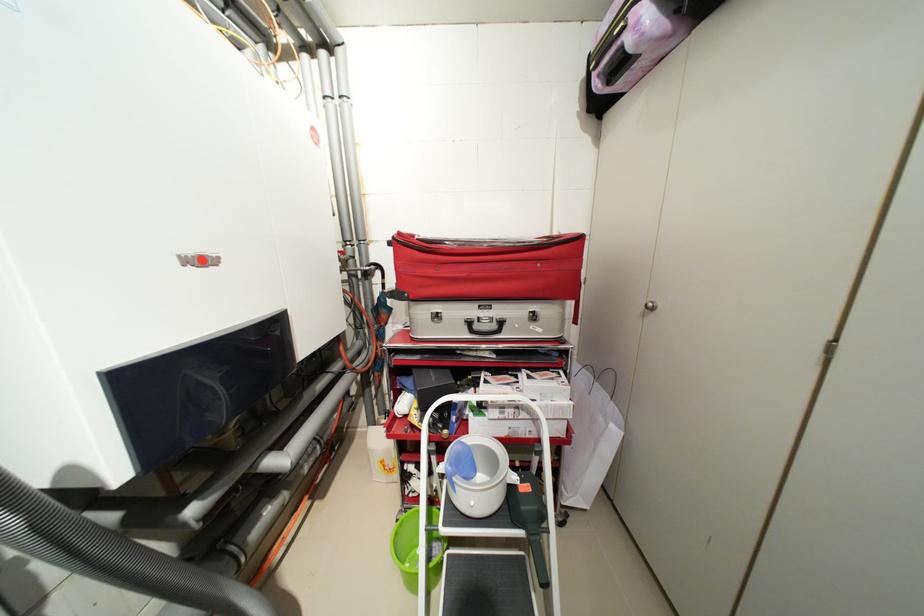
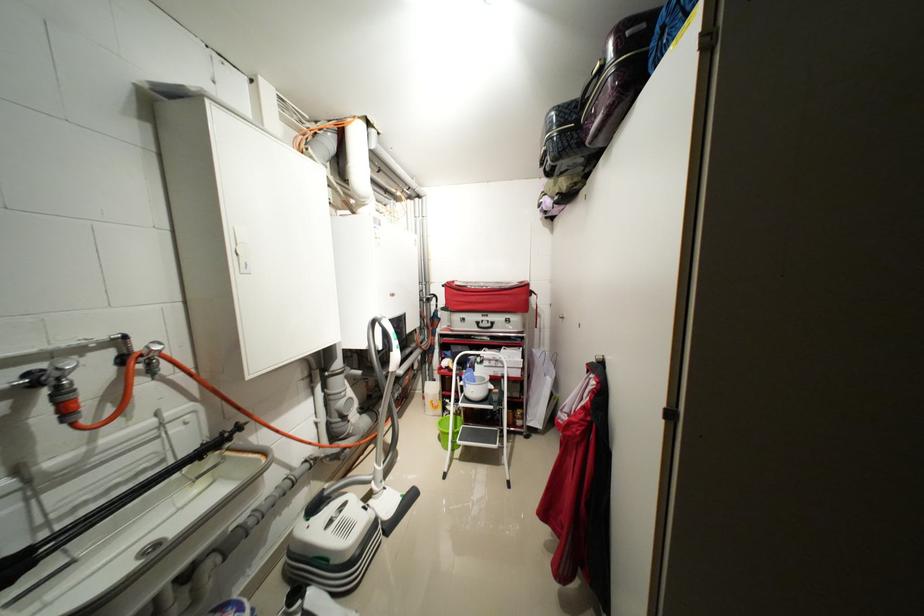
Where in the second image is the point corresponding to point (407, 235) from the first image?

(455, 284)